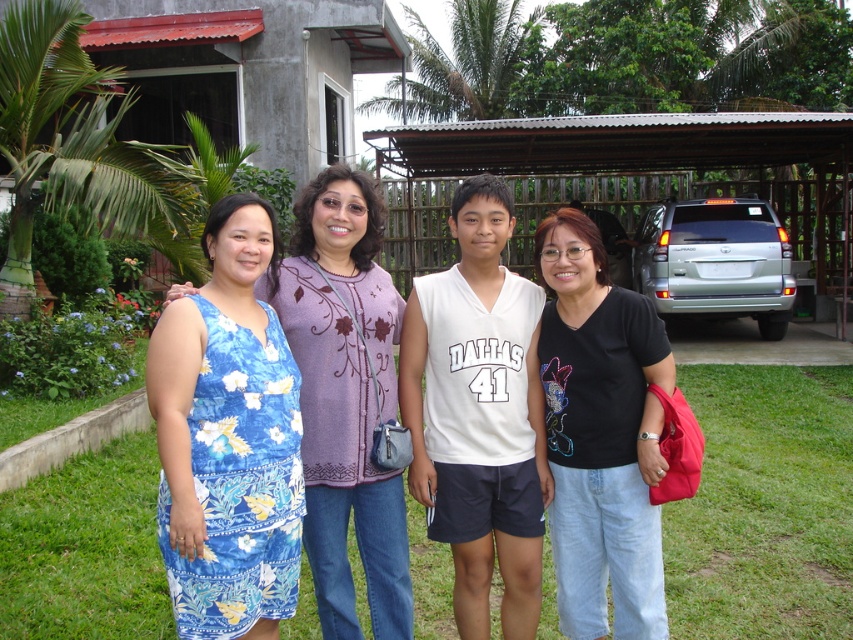
Question: Is white jersey at center further to the viewer compared to black cotton shirt at center?

Choices:
 (A) no
 (B) yes

Answer: (B)

Question: Which of these objects is positioned farthest from the white jersey at center?

Choices:
 (A) blue floral dress at left
 (B) black cotton shirt at center

Answer: (A)

Question: Can you confirm if white jersey at center is wider than blue floral dress at left?

Choices:
 (A) no
 (B) yes

Answer: (B)

Question: Which of the following is the closest to the observer?

Choices:
 (A) black cotton shirt at center
 (B) blue floral dress at left

Answer: (B)

Question: Which object appears farthest from the camera in this image?

Choices:
 (A) black cotton shirt at center
 (B) white jersey at center
 (C) blue floral dress at left

Answer: (B)

Question: From the image, what is the correct spatial relationship of white jersey at center in relation to blue floral dress at left?

Choices:
 (A) left
 (B) right

Answer: (B)